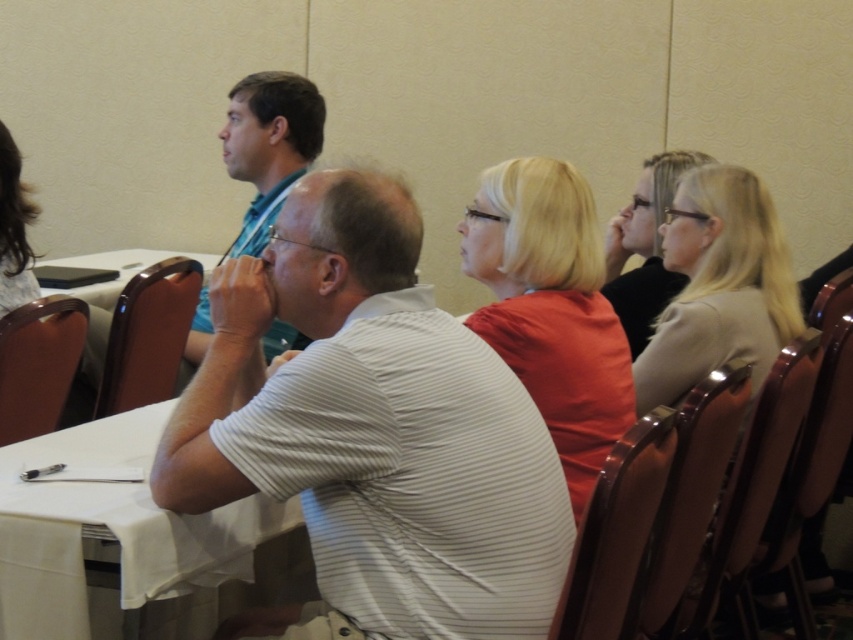
Can you confirm if white cloth at lower left is smaller than white plastic table at center?

Indeed, white cloth at lower left has a smaller size compared to white plastic table at center.

Can you confirm if white cloth at lower left is positioned below white plastic table at center?

Yes, white cloth at lower left is below white plastic table at center.

Between point (48, 556) and point (115, 298), which one is positioned behind?

The point (115, 298) is more distant.

Locate an element on the screen. The width and height of the screenshot is (853, 640). white cloth at lower left is located at coordinates (112, 529).

Which is behind, point (404, 452) or point (241, 124)?

Point (241, 124)

The image size is (853, 640). Describe the element at coordinates (374, 428) in the screenshot. I see `white striped shirt at center` at that location.

Is point (316, 474) positioned in front of point (306, 120)?

Yes, it is.

At what (x,y) coordinates should I click in order to perform the action: click on white striped shirt at center. Please return your answer as a coordinate pair (x, y). The width and height of the screenshot is (853, 640). Looking at the image, I should click on (374, 428).

Who is more forward, (318, 145) or (107, 291)?

Point (318, 145) is more forward.

Can you confirm if matte teal shirt at upper left is shorter than white plastic table at center?

No.

Which is in front, point (277, 330) or point (91, 371)?

Point (277, 330) is in front.

The image size is (853, 640). Find the location of `matte teal shirt at upper left`. matte teal shirt at upper left is located at coordinates (270, 145).